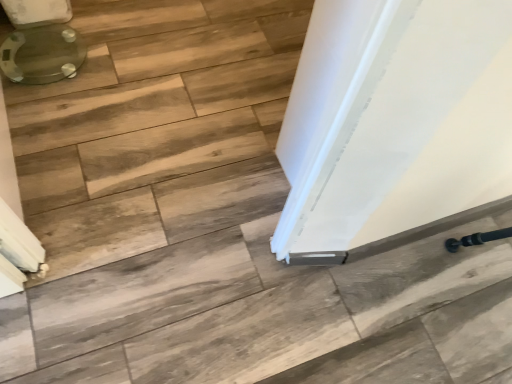
Question: In the image, is translucent glass toilet at upper left on the left side or the right side of white glossy door at center?

Choices:
 (A) left
 (B) right

Answer: (A)

Question: Is translucent glass toilet at upper left spatially inside white glossy door at center, or outside of it?

Choices:
 (A) inside
 (B) outside

Answer: (B)

Question: From the image's perspective, is translucent glass toilet at upper left above or below white glossy door at center?

Choices:
 (A) below
 (B) above

Answer: (B)

Question: Is white glossy door at center wider or thinner than translucent glass toilet at upper left?

Choices:
 (A) thin
 (B) wide

Answer: (A)

Question: Is white glossy door at center bigger or smaller than translucent glass toilet at upper left?

Choices:
 (A) small
 (B) big

Answer: (B)

Question: From their relative heights in the image, would you say white glossy door at center is taller or shorter than translucent glass toilet at upper left?

Choices:
 (A) tall
 (B) short

Answer: (A)

Question: From a real-world perspective, relative to translucent glass toilet at upper left, is white glossy door at center vertically above or below?

Choices:
 (A) below
 (B) above

Answer: (B)